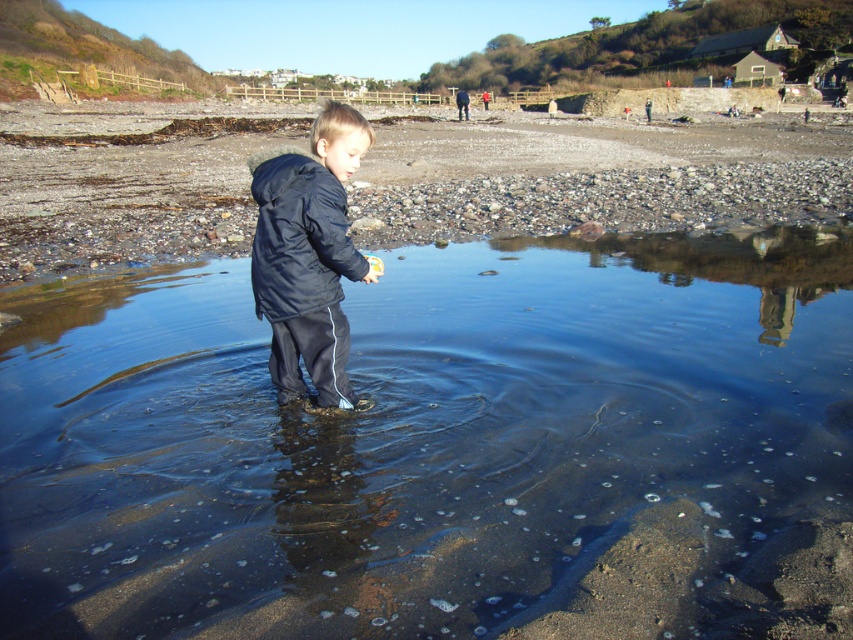
Who is shorter, smooth sand beach at center or matte black jacket at center?

Standing shorter between the two is matte black jacket at center.

Does point (178, 253) come closer to viewer compared to point (329, 294)?

No.

At what (x,y) coordinates should I click in order to perform the action: click on smooth sand beach at center. Please return your answer as a coordinate pair (x, y). Looking at the image, I should click on (596, 173).

Does clear water at center have a greater height compared to matte black jacket at center?

No.

Does clear water at center appear on the right side of matte black jacket at center?

Yes, clear water at center is to the right of matte black jacket at center.

Does point (694, 557) lie in front of point (328, 252)?

That is True.

This screenshot has width=853, height=640. I want to click on clear water at center, so click(444, 449).

Can you confirm if clear water at center is taller than smooth sand beach at center?

In fact, clear water at center may be shorter than smooth sand beach at center.

Between point (548, 288) and point (517, 154), which one is positioned behind?

The point (517, 154) is more distant.

Find the location of a particular element. This screenshot has height=640, width=853. clear water at center is located at coordinates (444, 449).

Where is `clear water at center`? Image resolution: width=853 pixels, height=640 pixels. clear water at center is located at coordinates (444, 449).